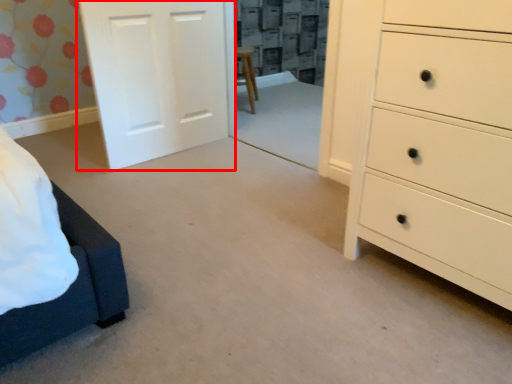
Question: Considering the relative positions of door (annotated by the red box) and chest of drawers in the image provided, where is door (annotated by the red box) located with respect to the staircase?

Choices:
 (A) left
 (B) right

Answer: (A)